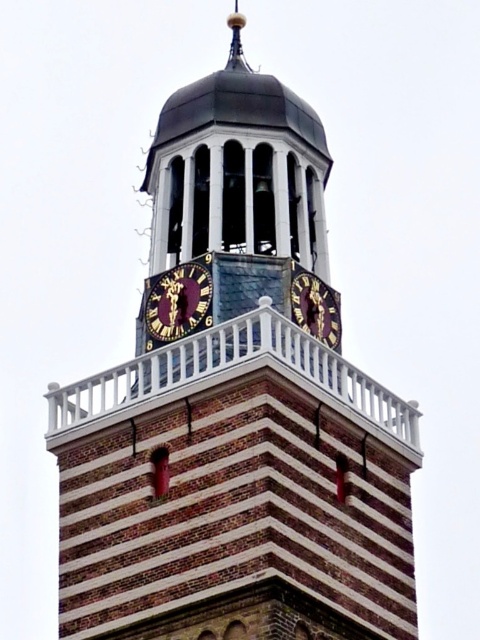
Between gold metallic clock at center and gold metallic clock at upper center, which one appears on the right side from the viewer's perspective?

Positioned to the right is gold metallic clock at upper center.

Does gold metallic clock at center appear on the right side of gold metallic clock at upper center?

Incorrect, gold metallic clock at center is not on the right side of gold metallic clock at upper center.

Locate an element on the screen. This screenshot has height=640, width=480. gold metallic clock at center is located at coordinates (178, 301).

Where is `gold metallic clock at center`? This screenshot has height=640, width=480. gold metallic clock at center is located at coordinates point(178,301).